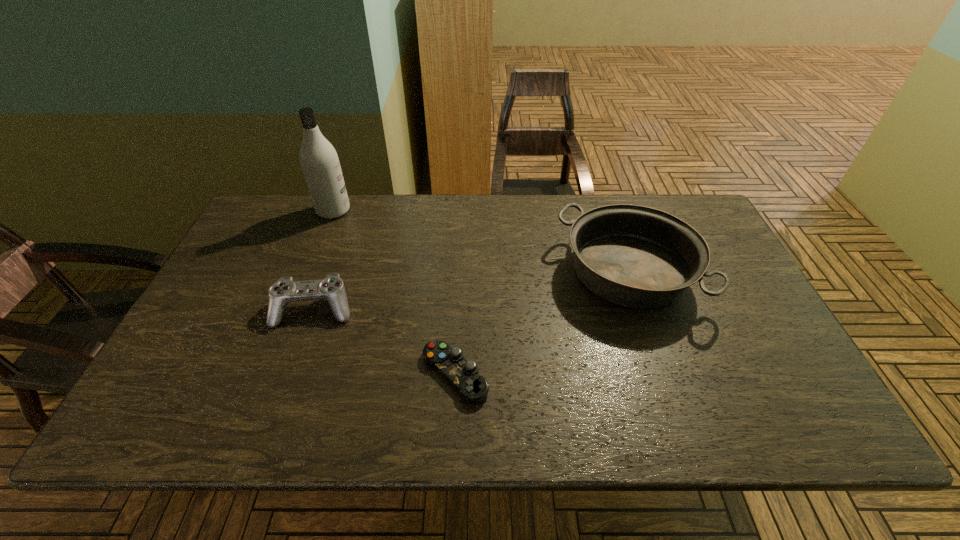
Where is `free spot between the shampoo and the taller control`? This screenshot has height=540, width=960. free spot between the shampoo and the taller control is located at coordinates (324, 260).

At what (x,y) coordinates should I click in order to perform the action: click on free spot between the third tallest object and the shortest object. Please return your answer as a coordinate pair (x, y). Looking at the image, I should click on (385, 341).

In order to click on unoccupied position between the second object from right to left and the shampoo in this screenshot , I will do `click(395, 292)`.

Select which object appears as the third closest to the pan. Please provide its 2D coordinates. Your answer should be formatted as a tuple, i.e. [(x, y)], where the tuple contains the x and y coordinates of a point satisfying the conditions above.

[(320, 164)]

Locate which object is the second closest to the nearer control. Please provide its 2D coordinates. Your answer should be formatted as a tuple, i.e. [(x, y)], where the tuple contains the x and y coordinates of a point satisfying the conditions above.

[(635, 256)]

Identify the location of free location that satisfies the following two spatial constraints: 1. on the back side of the pan; 2. on the left side of the right control. (460, 273).

Image resolution: width=960 pixels, height=540 pixels. Find the location of `vacant region that satisfies the following two spatial constraints: 1. on the front-facing side of the tallest object; 2. on the back side of the shorter control`. vacant region that satisfies the following two spatial constraints: 1. on the front-facing side of the tallest object; 2. on the back side of the shorter control is located at coordinates (270, 374).

Locate an element on the screen. free point that satisfies the following two spatial constraints: 1. on the front-facing side of the farther control; 2. on the left side of the farthest object is located at coordinates (295, 309).

Find the location of a particular element. free space in the image that satisfies the following two spatial constraints: 1. on the front-facing side of the shortest object; 2. on the right side of the shampoo is located at coordinates (270, 374).

I want to click on free region that satisfies the following two spatial constraints: 1. on the front-facing side of the tallest object; 2. on the left side of the shorter control, so click(270, 374).